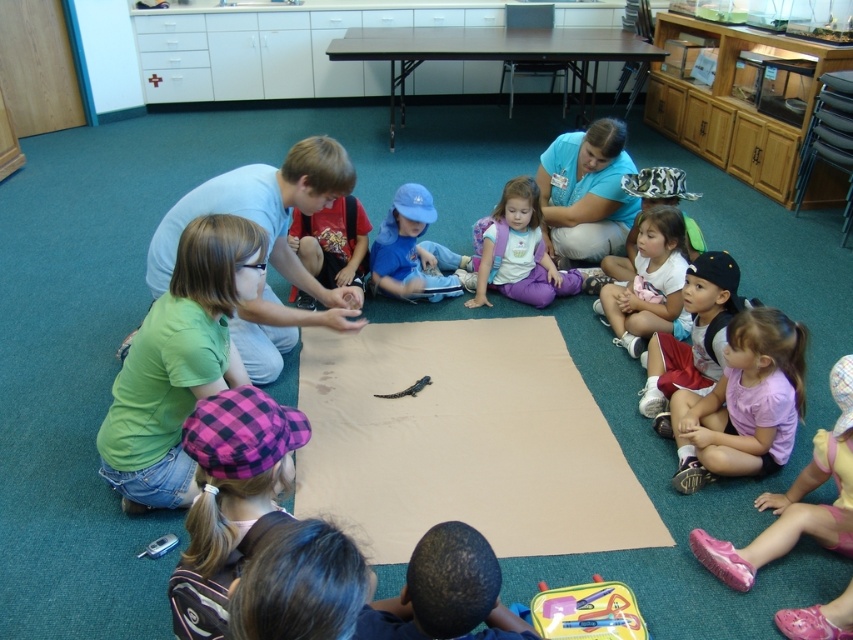
You are a photographer standing at the entrance of the classroom. You need to take a picture of the blue smooth shirt at upper center. Based on its coordinates, where should you position your camera to capture it clearly?

The blue smooth shirt at upper center is located at point (x=585, y=193), so position your camera to aim at that coordinate to capture it clearly.

You are a teacher in the classroom. You need to place a new item on the floor where the green matte shirt at center and the matte yellow lunchbox at lower center are located. Where should you place the new item so it doesn not block the view of the alligator?

Place the new item between the green matte shirt at center and the matte yellow lunchbox at lower center since the green matte shirt at center is above the matte yellow lunchbox at lower center, ensuring it stays out of the way of the alligator.